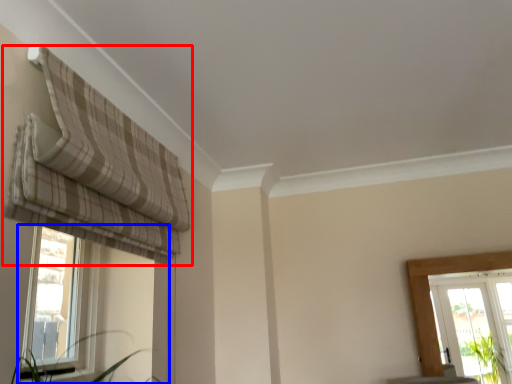
Question: Which point is further to the camera, curtain (highlighted by a red box) or window (highlighted by a blue box)?

Choices:
 (A) curtain
 (B) window

Answer: (B)